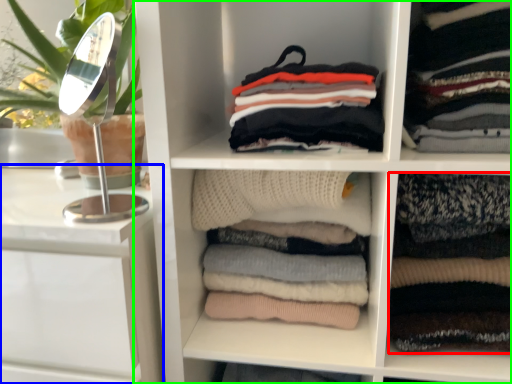
Question: Considering the real-world distances, which object is closest to clothing (highlighted by a red box)? vanity (highlighted by a blue box) or shelf (highlighted by a green box).

Choices:
 (A) vanity
 (B) shelf

Answer: (B)